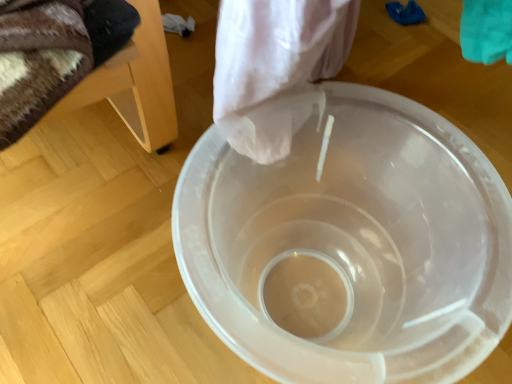
Question: From a real-world perspective, is wooden chair at left physically located above or below transparent plastic bucket at center?

Choices:
 (A) above
 (B) below

Answer: (A)

Question: In terms of size, does wooden chair at left appear bigger or smaller than transparent plastic bucket at center?

Choices:
 (A) small
 (B) big

Answer: (A)

Question: Is point click(111, 92) positioned closer to the camera than point click(435, 157)?

Choices:
 (A) farther
 (B) closer

Answer: (B)

Question: Is transparent plastic bucket at center inside or outside of wooden chair at left?

Choices:
 (A) outside
 (B) inside

Answer: (A)

Question: Considering the positions of transparent plastic bucket at center and wooden chair at left in the image, is transparent plastic bucket at center taller or shorter than wooden chair at left?

Choices:
 (A) tall
 (B) short

Answer: (A)

Question: Is transparent plastic bucket at center wider or thinner than wooden chair at left?

Choices:
 (A) wide
 (B) thin

Answer: (A)

Question: From a real-world perspective, relative to wooden chair at left, is transparent plastic bucket at center vertically above or below?

Choices:
 (A) above
 (B) below

Answer: (B)